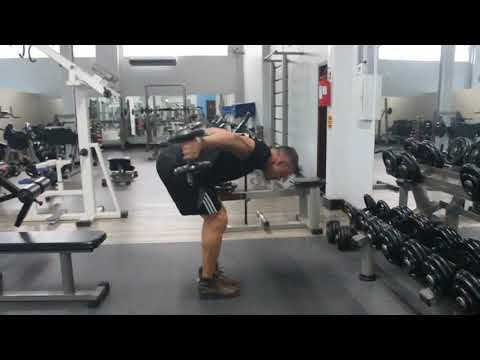
This screenshot has height=360, width=480. Find the location of `mirror`. mirror is located at coordinates click(x=106, y=104), click(x=137, y=104), click(x=170, y=103).